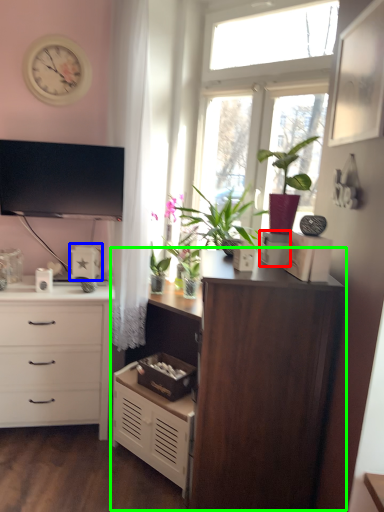
Question: Which is farther away from storage box (highlighted by a red box)? appliance (highlighted by a blue box) or cupboard (highlighted by a green box)?

Choices:
 (A) appliance
 (B) cupboard

Answer: (A)